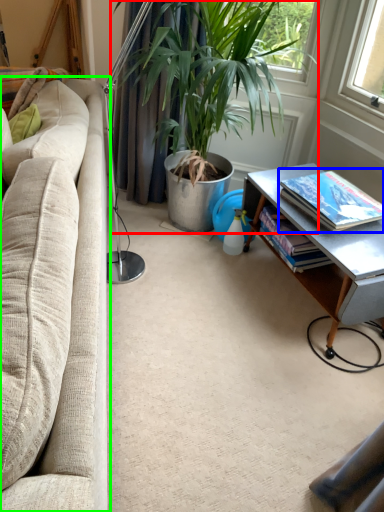
Question: Which object is positioned closest to houseplant (highlighted by a red box)? Select from book (highlighted by a blue box) and studio couch (highlighted by a green box).

Choices:
 (A) book
 (B) studio couch

Answer: (B)